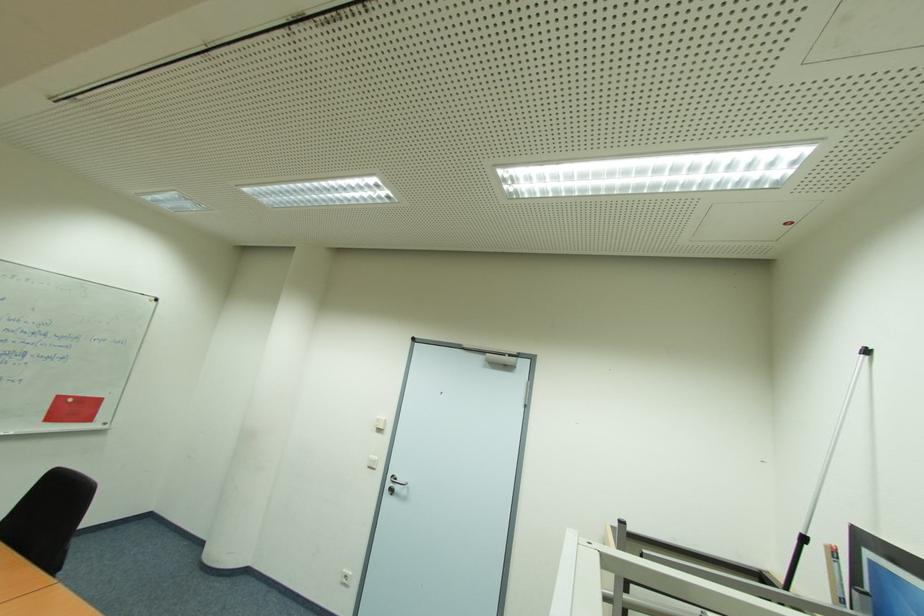
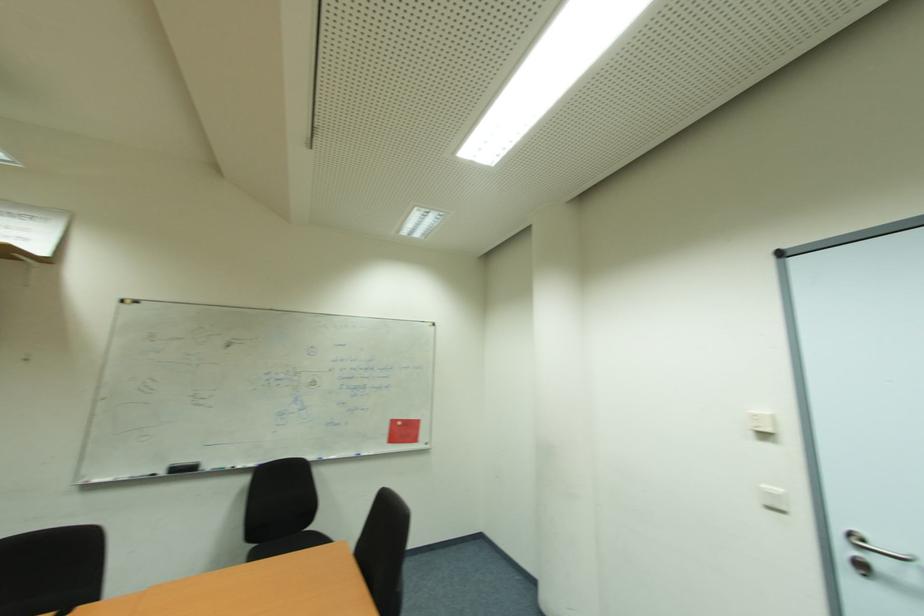
Find the pixel in the second image that matches the point at 380,459 in the first image.

(784, 492)